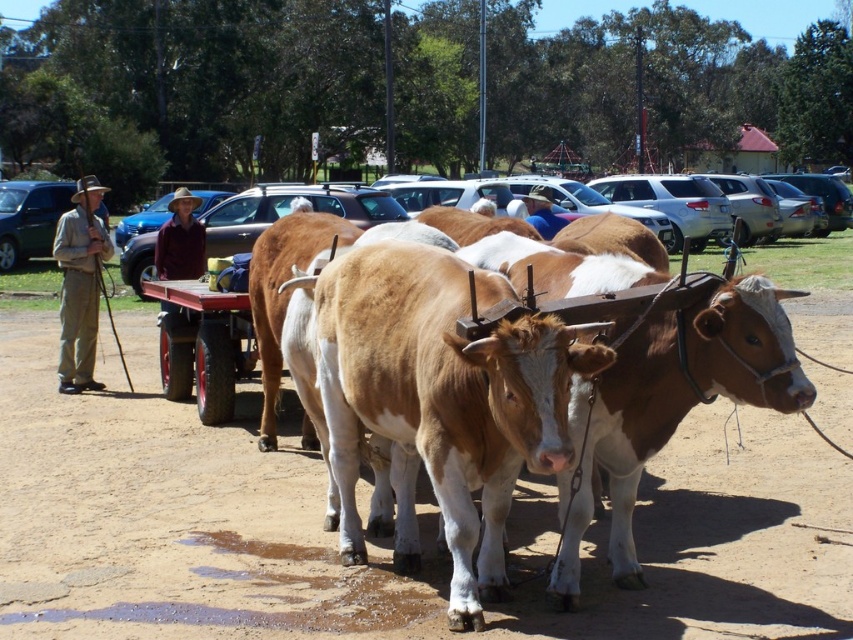
Question: Which point is closer to the camera?

Choices:
 (A) (80, 291)
 (B) (450, 520)
 (C) (28, 250)
 (D) (169, 240)

Answer: (B)

Question: Is brown smooth cow at center positioned in front of matte black suv at left?

Choices:
 (A) yes
 (B) no

Answer: (A)

Question: Estimate the real-world distances between objects in this image. Which object is closer to the blue metallic car at center?

Choices:
 (A) brown smooth cow at center
 (B) brown cotton shirt at center
 (C) khaki fabric pants at left
 (D) matte black suv at left

Answer: (D)

Question: Which object is positioned closest to the brown cotton shirt at center?

Choices:
 (A) blue metallic car at center
 (B) brown smooth cow at center

Answer: (B)

Question: Is brown cotton shirt at center closer to the viewer compared to blue metallic car at center?

Choices:
 (A) no
 (B) yes

Answer: (B)

Question: Does brown smooth cow at center have a smaller size compared to brown cotton shirt at center?

Choices:
 (A) yes
 (B) no

Answer: (A)